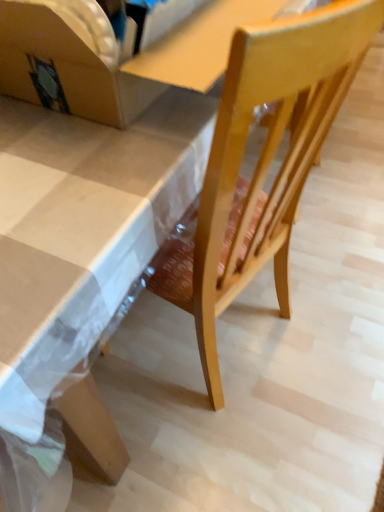
Describe the element at coordinates (262, 162) in the screenshot. I see `light wood chair at center` at that location.

Where is `light wood chair at center`? light wood chair at center is located at coordinates (262, 162).

Where is `light wood chair at center`? light wood chair at center is located at coordinates (262, 162).